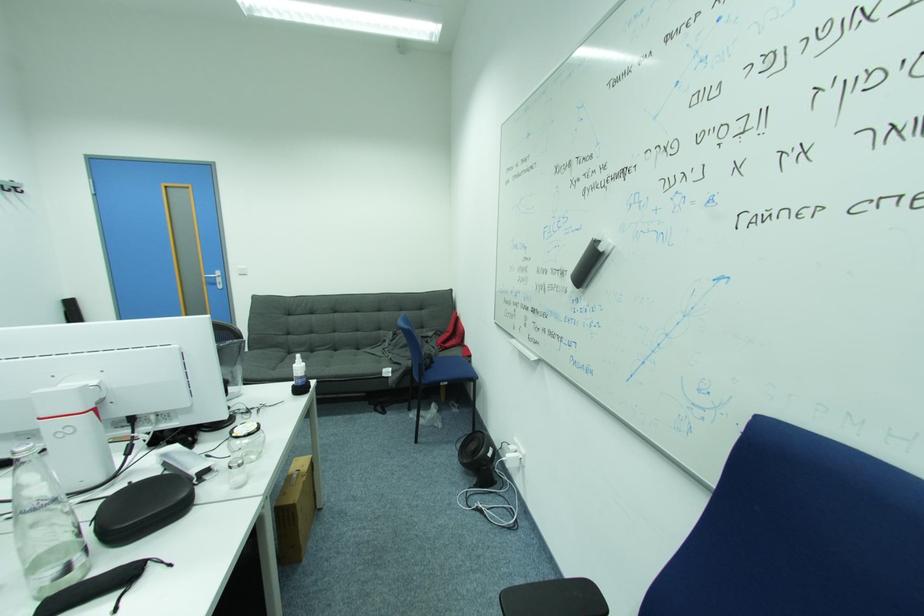
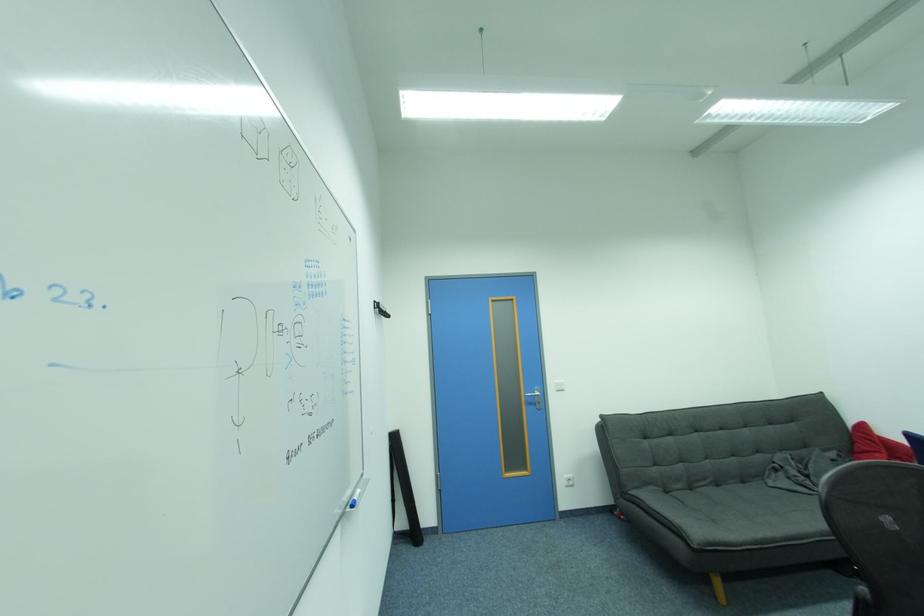
The point at (x=246, y=267) is marked in the first image. Where is the corresponding point in the second image?

(564, 382)